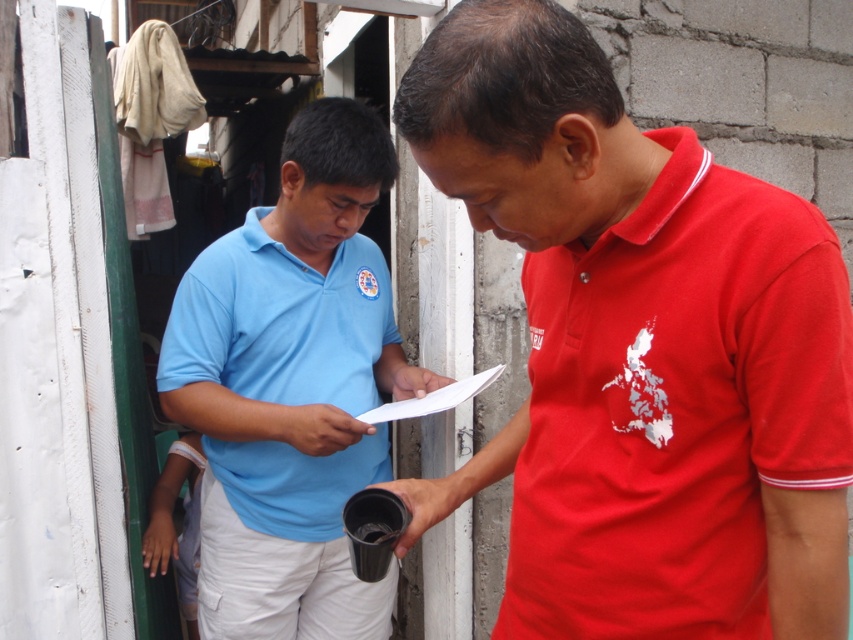
Does point (610, 564) come closer to viewer compared to point (334, 205)?

Yes, point (610, 564) is closer to viewer.

Between matte red polo shirt at center and matte blue polo shirt at center, which one appears on the left side from the viewer's perspective?

From the viewer's perspective, matte blue polo shirt at center appears more on the left side.

Is point (613, 284) more distant than point (395, 374)?

No, it is in front of (395, 374).

The height and width of the screenshot is (640, 853). Find the location of `matte red polo shirt at center`. matte red polo shirt at center is located at coordinates (641, 353).